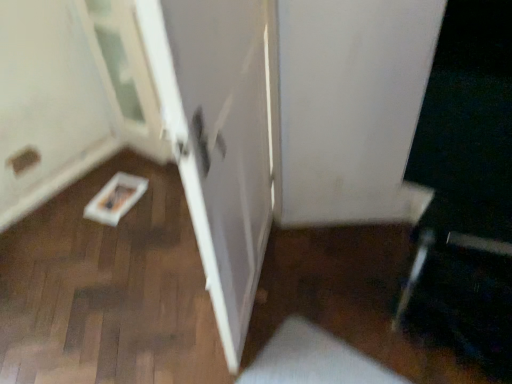
Describe the element at coordinates (224, 147) in the screenshot. The width and height of the screenshot is (512, 384). I see `white glossy door at center` at that location.

The width and height of the screenshot is (512, 384). In order to click on white glossy door at center in this screenshot , I will do `click(224, 147)`.

Measure the distance between point (204,94) and camera.

The depth of point (204,94) is 36.69 inches.

You are a GUI agent. You are given a task and a screenshot of the screen. Output one action in this format:
    pyautogui.click(x=<x>, y=<y>)
    Task: Click on the white glossy door at center
    Image resolution: width=512 pixels, height=384 pixels.
    Given the screenshot: What is the action you would take?
    pyautogui.click(x=224, y=147)